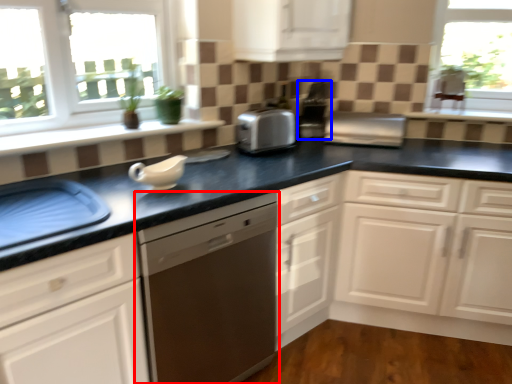
Question: Which of the following is the farthest to the observer, dishwasher (highlighted by a red box) or coffee machine (highlighted by a blue box)?

Choices:
 (A) dishwasher
 (B) coffee machine

Answer: (B)